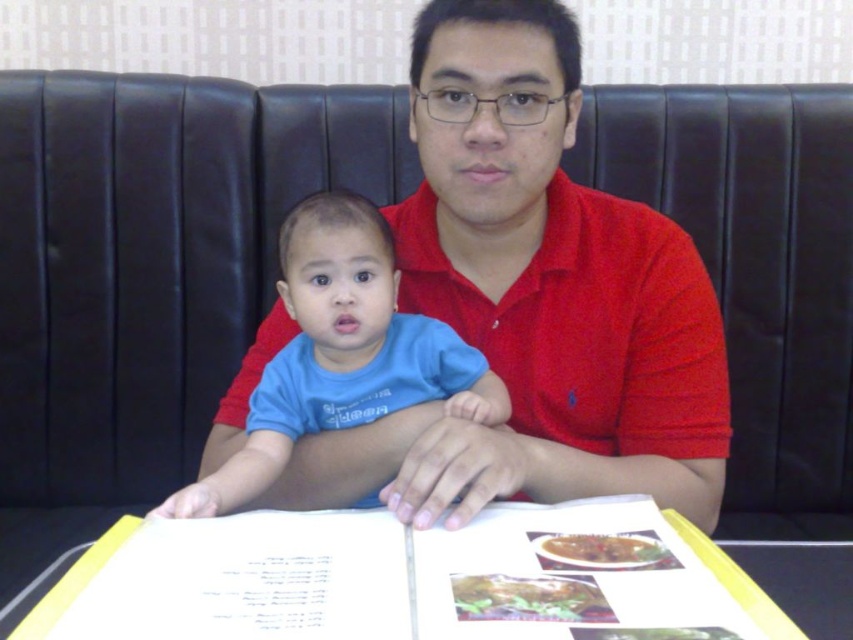
Who is lower down, red cotton shirt at center or blue cotton shirt at center?

blue cotton shirt at center

Between red cotton shirt at center and blue cotton shirt at center, which one has less height?

blue cotton shirt at center

At what (x,y) coordinates should I click in order to perform the action: click on red cotton shirt at center. Please return your answer as a coordinate pair (x, y). Image resolution: width=853 pixels, height=640 pixels. Looking at the image, I should click on (532, 300).

Does red cotton shirt at center appear on the right side of yellow paper menu at center?

No, red cotton shirt at center is not to the right of yellow paper menu at center.

Consider the image. Does red cotton shirt at center appear over yellow paper menu at center?

Indeed, red cotton shirt at center is positioned over yellow paper menu at center.

Who is more distant from viewer, (456,292) or (828,632)?

The point (456,292) is more distant.

Find the location of a particular element. Image resolution: width=853 pixels, height=640 pixels. red cotton shirt at center is located at coordinates (532, 300).

The height and width of the screenshot is (640, 853). I want to click on blue cotton shirt at center, so click(341, 353).

Is blue cotton shirt at center to the left of yellow paper menu at center from the viewer's perspective?

Yes, blue cotton shirt at center is to the left of yellow paper menu at center.

Find the location of `blue cotton shirt at center`. blue cotton shirt at center is located at coordinates (341, 353).

Image resolution: width=853 pixels, height=640 pixels. I want to click on blue cotton shirt at center, so click(341, 353).